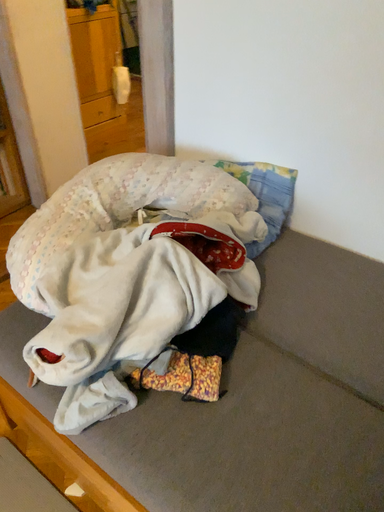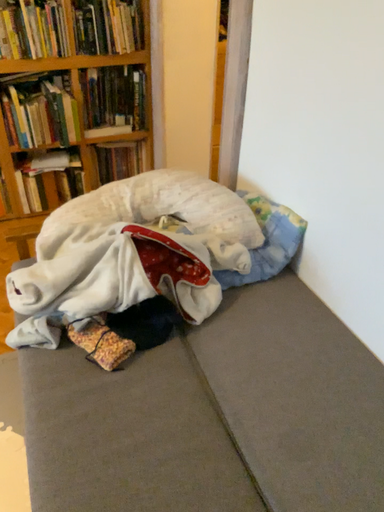
Question: How did the camera likely rotate when shooting the video?

Choices:
 (A) rotated right
 (B) rotated left

Answer: (B)